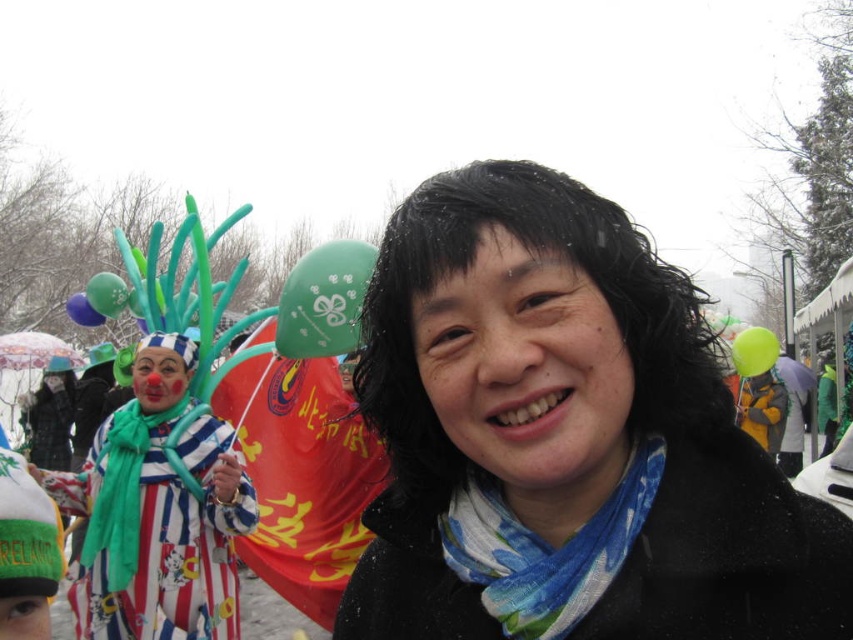
Question: Which object is positioned farthest from the green matte balloon at upper center?

Choices:
 (A) green rubber balloon at right
 (B) green rubber balloon at upper left
 (C) matte blue balloon at upper left
 (D) striped fabric clown at left

Answer: (A)

Question: Among these objects, which one is farthest from the camera?

Choices:
 (A) green rubber balloon at upper left
 (B) black matte scarf at center
 (C) matte blue balloon at upper left

Answer: (C)

Question: Does green rubber balloon at right appear over green rubber balloon at upper left?

Choices:
 (A) no
 (B) yes

Answer: (A)

Question: Which of the following is the closest to the observer?

Choices:
 (A) (91, 317)
 (B) (177, 369)
 (C) (90, 298)

Answer: (B)

Question: Is green matte balloon at upper center thinner than matte blue balloon at upper left?

Choices:
 (A) no
 (B) yes

Answer: (A)

Question: Can you confirm if black matte scarf at center is thinner than matte blue balloon at upper left?

Choices:
 (A) yes
 (B) no

Answer: (B)